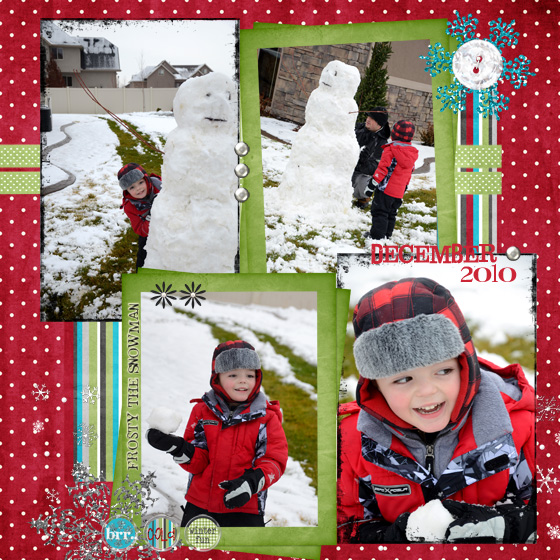
I want to click on picture collage, so click(x=511, y=94), click(x=60, y=525), click(x=44, y=380), click(x=508, y=160).